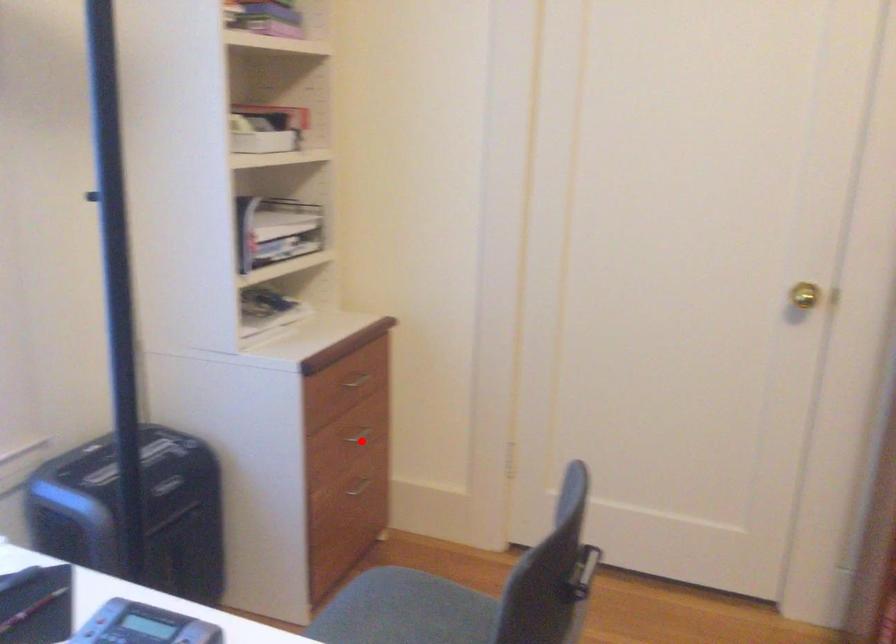
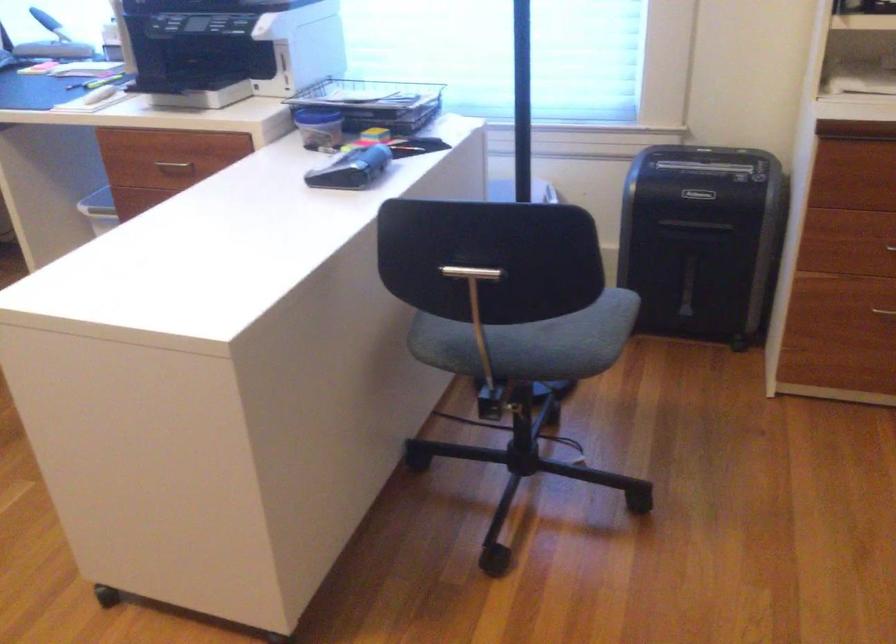
Question: I am providing you with two images of the same scene from different viewpoints. In image1, a red point is highlighted. Considering the same 3D point in image2, which of the following is correct?

Choices:
 (A) It is closer
 (B) It is farther

Answer: (A)